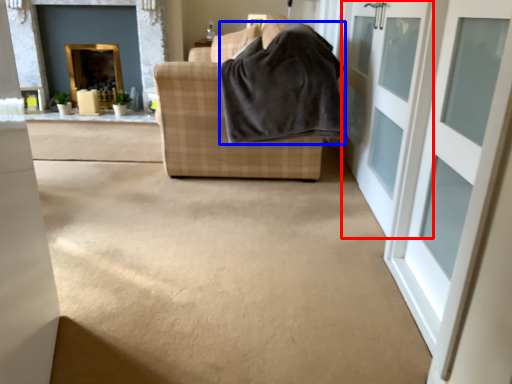
Question: Which object is further to the camera taking this photo, door (highlighted by a red box) or blanket (highlighted by a blue box)?

Choices:
 (A) door
 (B) blanket

Answer: (B)